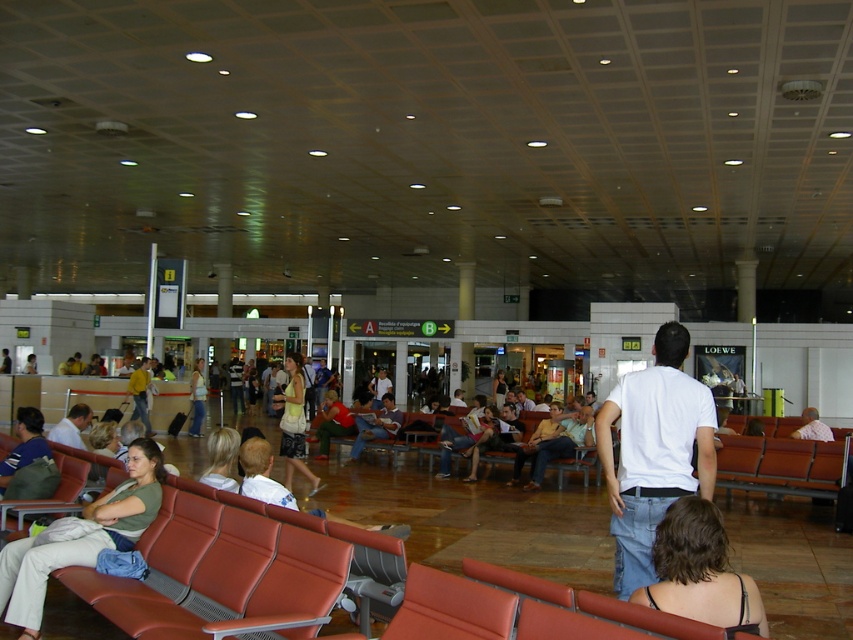
Question: Is light beige pants at lower left smaller than matte white shirt at center?

Choices:
 (A) yes
 (B) no

Answer: (B)

Question: Which object is closer to the camera taking this photo?

Choices:
 (A) matte white shirt at center
 (B) yellow cotton shirt at center
 (C) light brown leather jacket at center
 (D) dark brown hair at lower right

Answer: (D)

Question: Which point appears farthest from the camera in this image?

Choices:
 (A) (42, 564)
 (B) (148, 422)
 (C) (643, 465)
 (D) (709, 557)

Answer: (B)

Question: Which point is farther from the camera taking this photo?

Choices:
 (A) (685, 600)
 (B) (401, 417)
 (C) (651, 545)

Answer: (B)

Question: Is matte yellow dress at center smaller than matte white shirt at center?

Choices:
 (A) yes
 (B) no

Answer: (B)

Question: Can you confirm if dark brown hair at lower right is positioned to the right of matte white shirt at center?

Choices:
 (A) no
 (B) yes

Answer: (B)